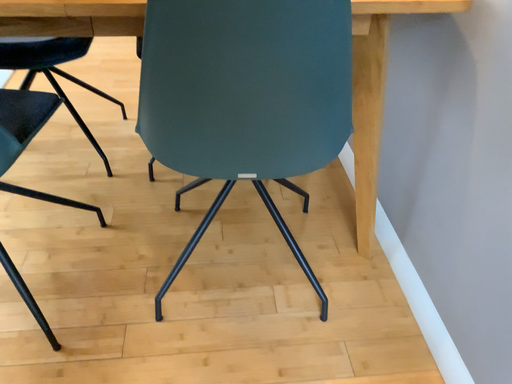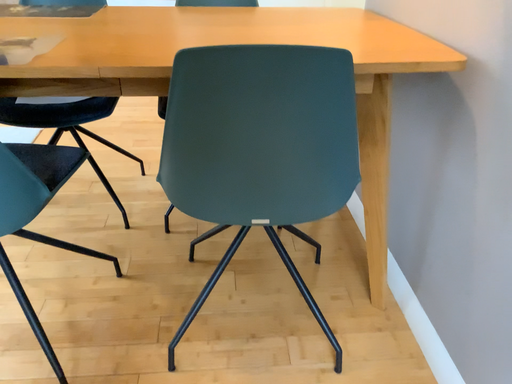
Question: How did the camera likely rotate when shooting the video?

Choices:
 (A) rotated downward
 (B) rotated upward

Answer: (B)